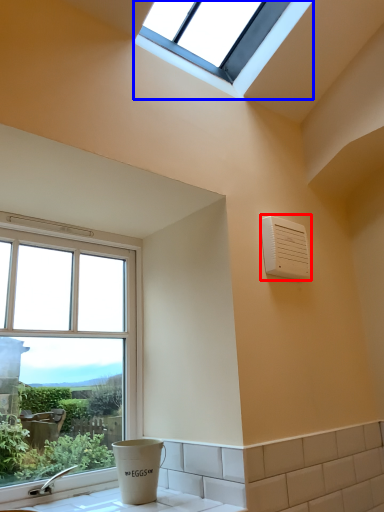
Question: Among these objects, which one is nearest to the camera, air conditioning (highlighted by a red box) or window (highlighted by a blue box)?

Choices:
 (A) air conditioning
 (B) window

Answer: (B)